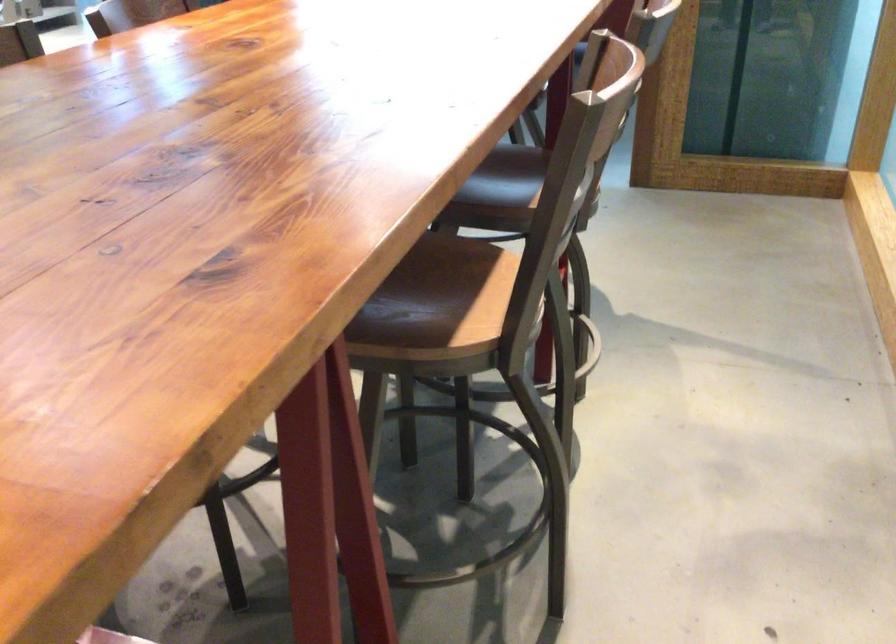
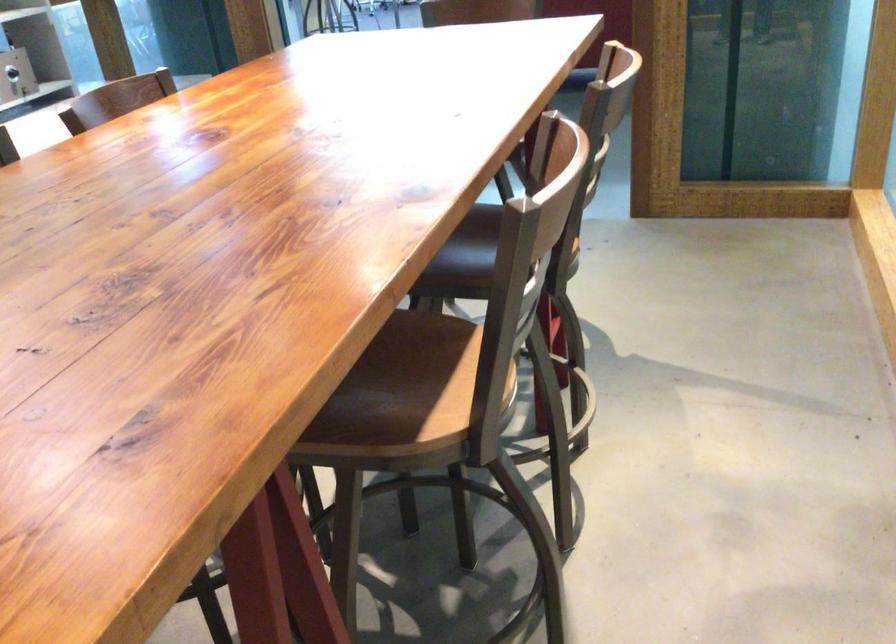
Question: What movement of the cameraman would produce the second image?

Choices:
 (A) Left
 (B) Right
 (C) Forward
 (D) Backward

Answer: (B)